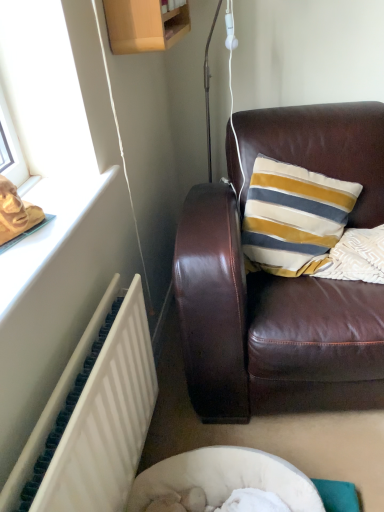
Question: Is white textured radiator at lower left to the left or to the right of brown leather couch at center in the image?

Choices:
 (A) right
 (B) left

Answer: (B)

Question: Based on their sizes in the image, would you say white textured radiator at lower left is bigger or smaller than brown leather couch at center?

Choices:
 (A) small
 (B) big

Answer: (A)

Question: Is point (137, 364) closer or farther from the camera than point (256, 333)?

Choices:
 (A) closer
 (B) farther

Answer: (B)

Question: Is brown leather couch at center inside or outside of white textured radiator at lower left?

Choices:
 (A) outside
 (B) inside

Answer: (A)

Question: Is brown leather couch at center wider or thinner than white textured radiator at lower left?

Choices:
 (A) wide
 (B) thin

Answer: (A)

Question: Considering the positions of point (350, 224) and point (125, 409), is point (350, 224) closer or farther from the camera than point (125, 409)?

Choices:
 (A) farther
 (B) closer

Answer: (A)

Question: Is brown leather couch at center taller or shorter than white textured radiator at lower left?

Choices:
 (A) short
 (B) tall

Answer: (B)